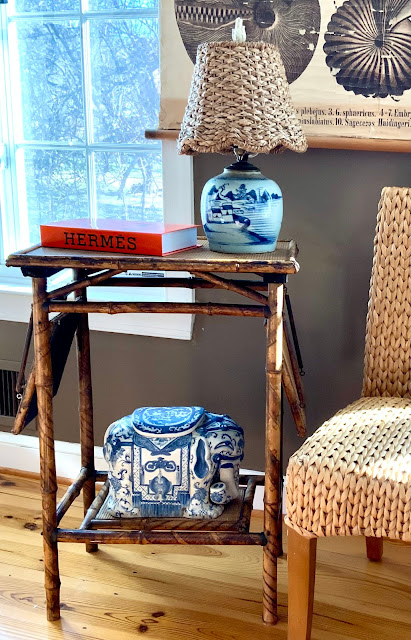
Locate an element on the screen. book is located at coordinates (146, 244).